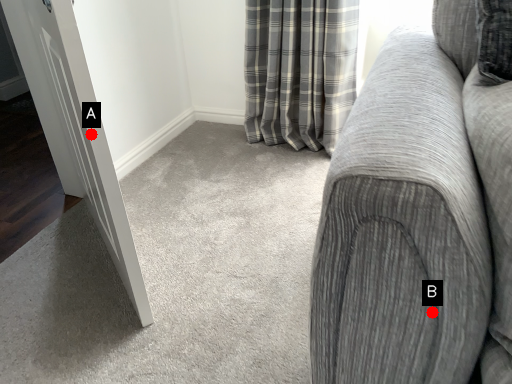
Question: Two points are circled on the image, labeled by A and B beside each circle. Among these points, which one is farthest from the camera?

Choices:
 (A) A is further
 (B) B is further

Answer: (A)